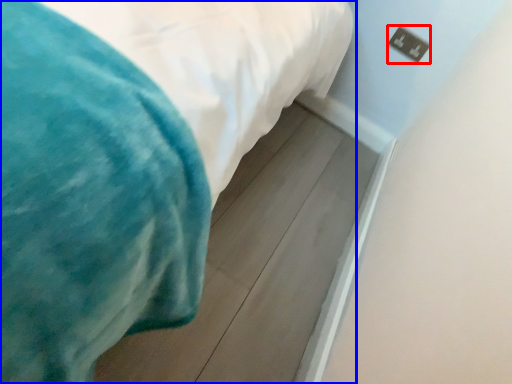
Question: Among these objects, which one is nearest to the camera, electric outlet (highlighted by a red box) or bed (highlighted by a blue box)?

Choices:
 (A) electric outlet
 (B) bed

Answer: (B)